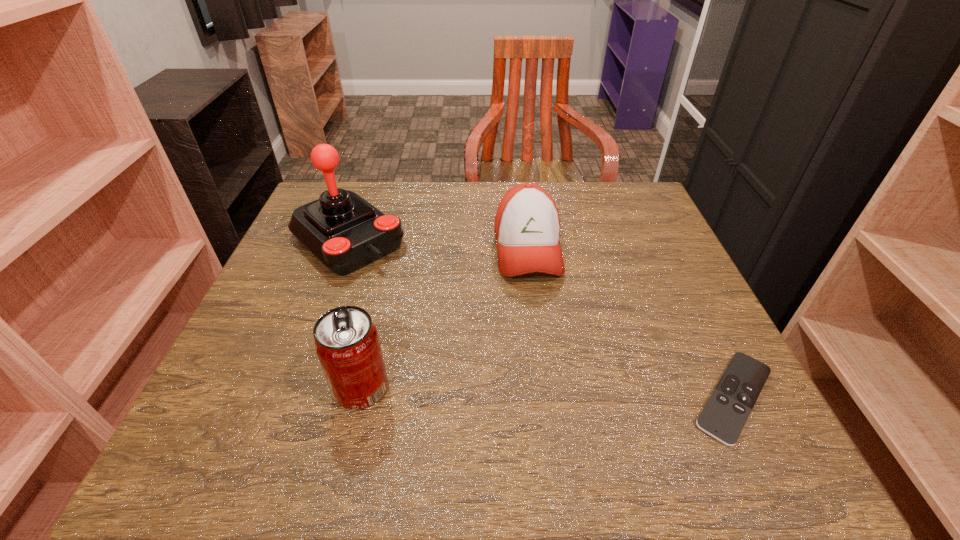
Where is `vacant space on the desktop that is between the pop soda and the remote control and is positioned on the front-facing side of the baseball cap`? This screenshot has height=540, width=960. vacant space on the desktop that is between the pop soda and the remote control and is positioned on the front-facing side of the baseball cap is located at coordinates (554, 393).

You are a GUI agent. You are given a task and a screenshot of the screen. Output one action in this format:
    pyautogui.click(x=<x>, y=<y>)
    Task: Click on the vacant spot on the desktop that is between the pop soda and the shortest object and is positioned on the base of the joystick
    This screenshot has width=960, height=540.
    Given the screenshot: What is the action you would take?
    pyautogui.click(x=522, y=392)